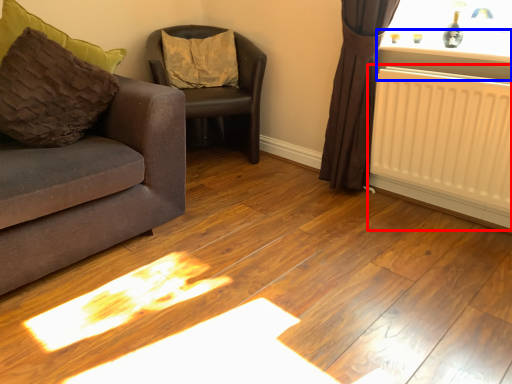
Question: Which point is closer to the camera, radiator (highlighted by a red box) or window sill (highlighted by a blue box)?

Choices:
 (A) radiator
 (B) window sill

Answer: (A)